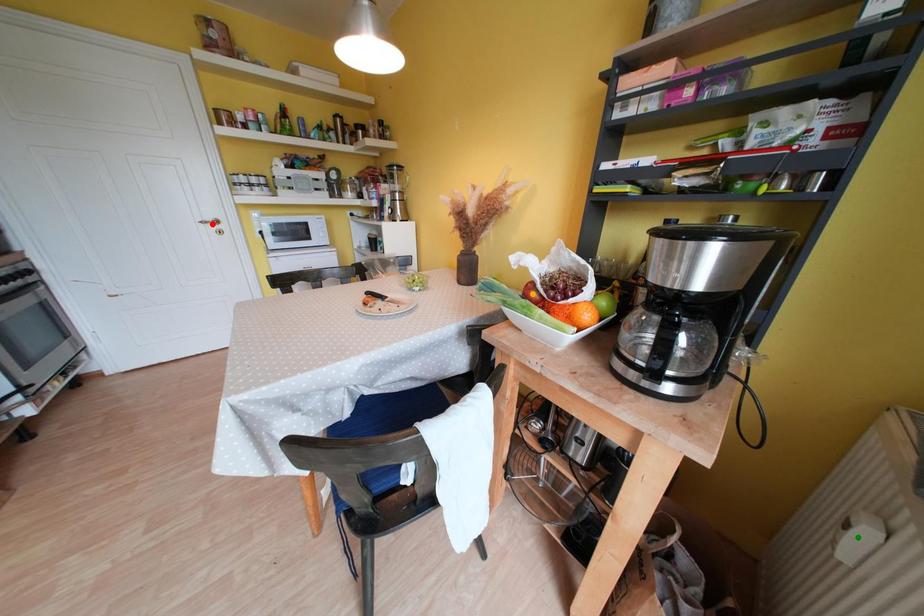
Order these from nearest to farthest:
orange point | red point | green point

green point
orange point
red point